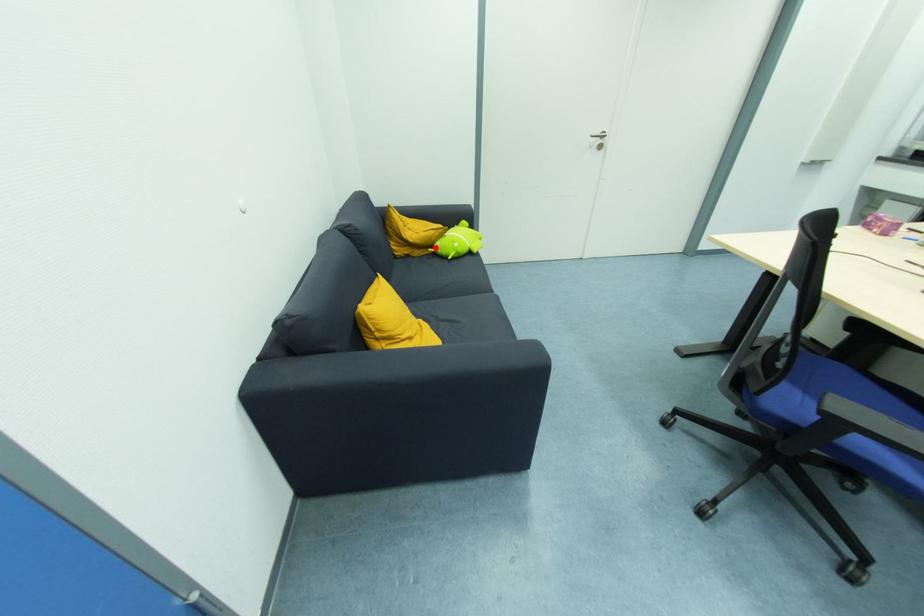
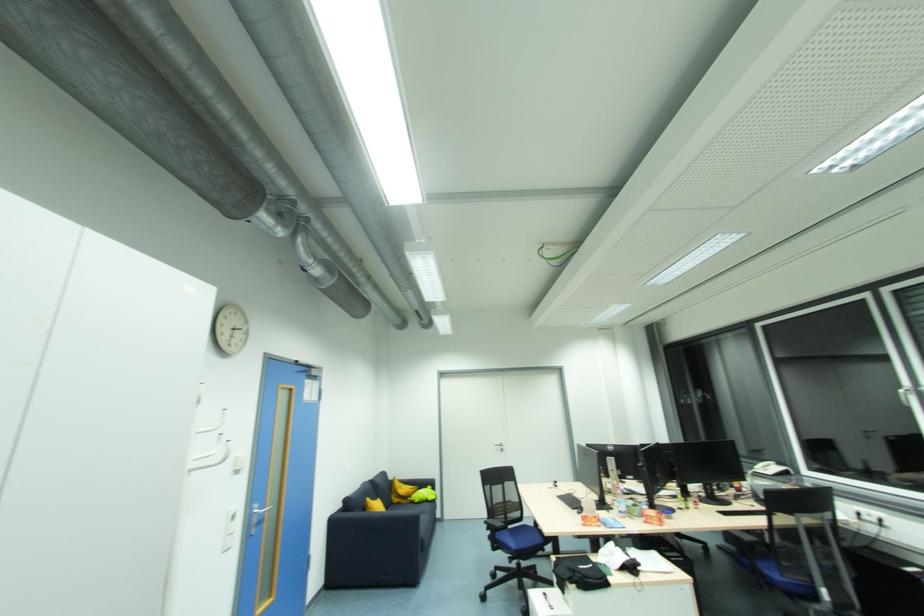
Locate, in the second image, the point that corresponds to the highlighted location in the first image.

(412, 499)